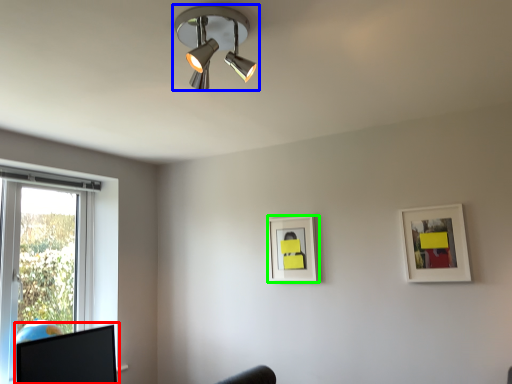
Question: Which is farther away from computer monitor (highlighted by a red box)? lamp (highlighted by a blue box) or picture frame (highlighted by a green box)?

Choices:
 (A) lamp
 (B) picture frame

Answer: (A)